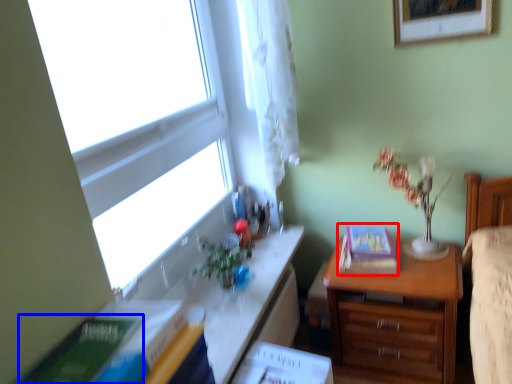
Question: Among these objects, which one is nearest to the camera, paperback book (highlighted by a red box) or paperback book (highlighted by a blue box)?

Choices:
 (A) paperback book
 (B) paperback book

Answer: (B)